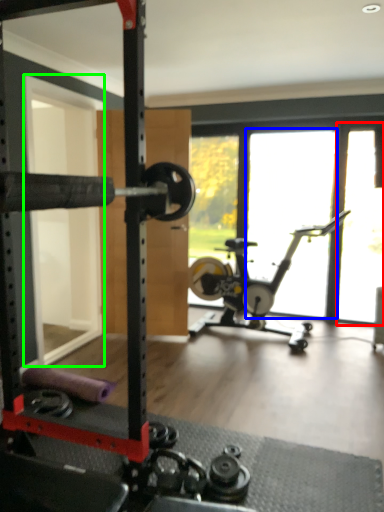
Question: Based on their relative distances, which object is farther from window screen (highlighted by a red box)? Choose from window (highlighted by a blue box) and screen door (highlighted by a green box).

Choices:
 (A) window
 (B) screen door

Answer: (B)